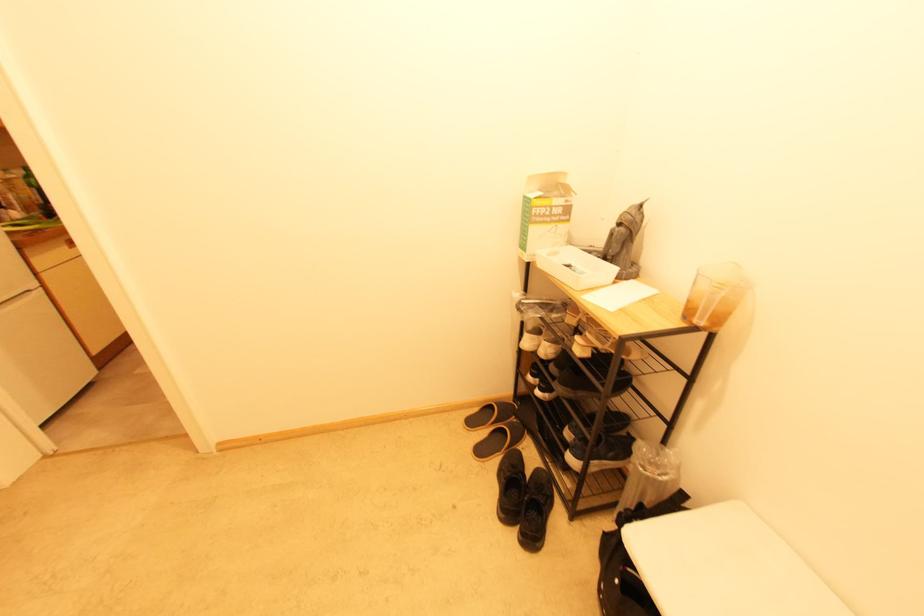
Describe the element at coordinates (714, 294) in the screenshot. I see `a plastic liquid container` at that location.